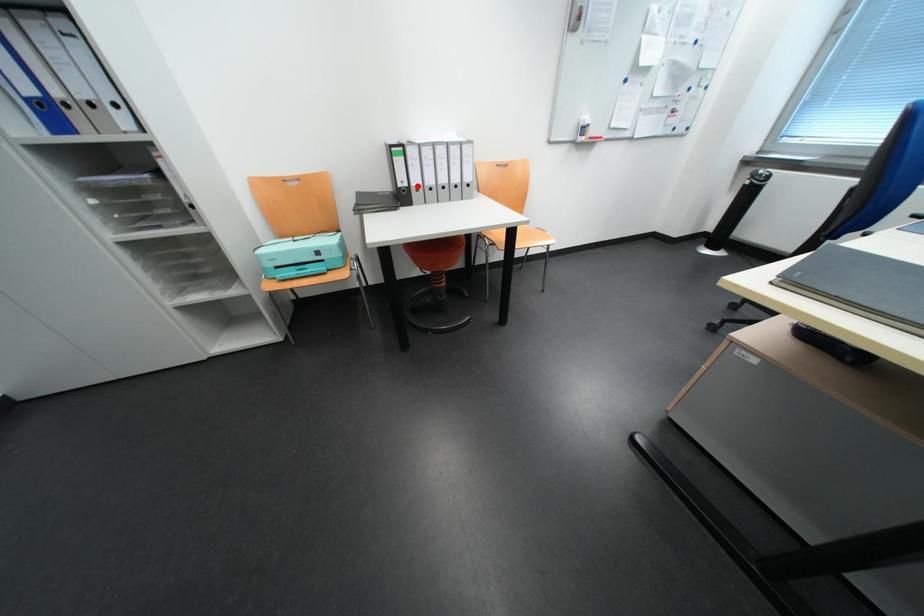
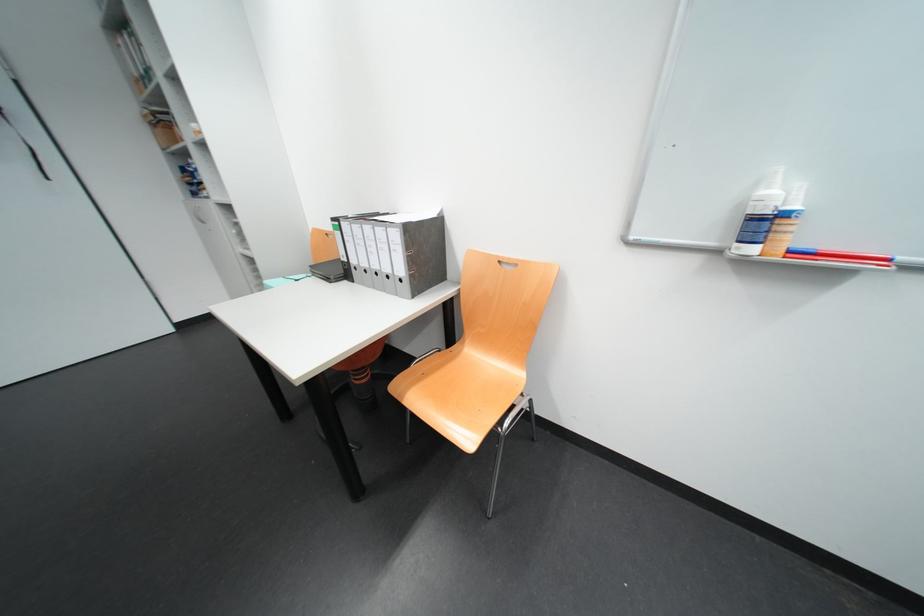
In the second image, find the point that corresponds to the highlighted location in the first image.

(358, 262)